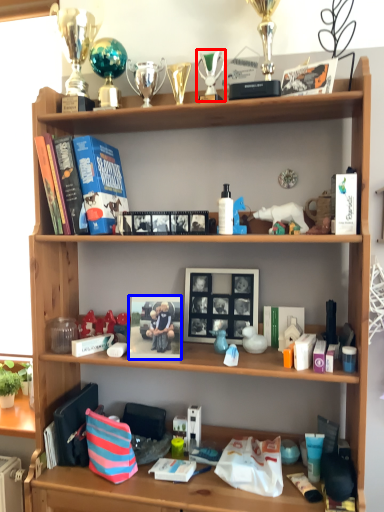
Question: Which object appears farthest to the camera in this image, toy (highlighted by a red box) or book cover (highlighted by a blue box)?

Choices:
 (A) toy
 (B) book cover

Answer: (A)